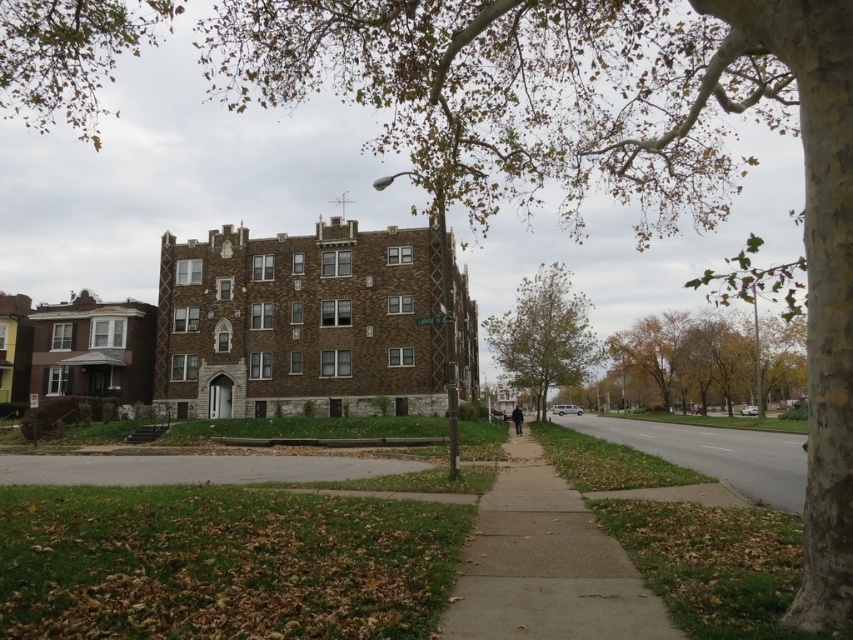
You are standing at the edge of the residential street scene. You want to walk to the gray asphalt pavement at lower center. According to the coordinates provided, where exactly should you head towards?

The gray asphalt pavement at lower center is located at coordinates point (192, 468), so you should head towards that point.

From the picture: You are a delivery person trying to navigate a narrow path between the concrete sidewalk at center and the gray asphalt pavement at lower center. Which path has a narrower width?

The concrete sidewalk at center has a narrower width than the gray asphalt pavement at lower center.

You are a delivery person trying to park your van on the gray asphalt pavement at lower center. The van requires a space wider than the green leafy tree at center. Can you park there?

The gray asphalt pavement at lower center is wider than the green leafy tree at center, so yes, the van can park there since the pavement is wider than the tree.